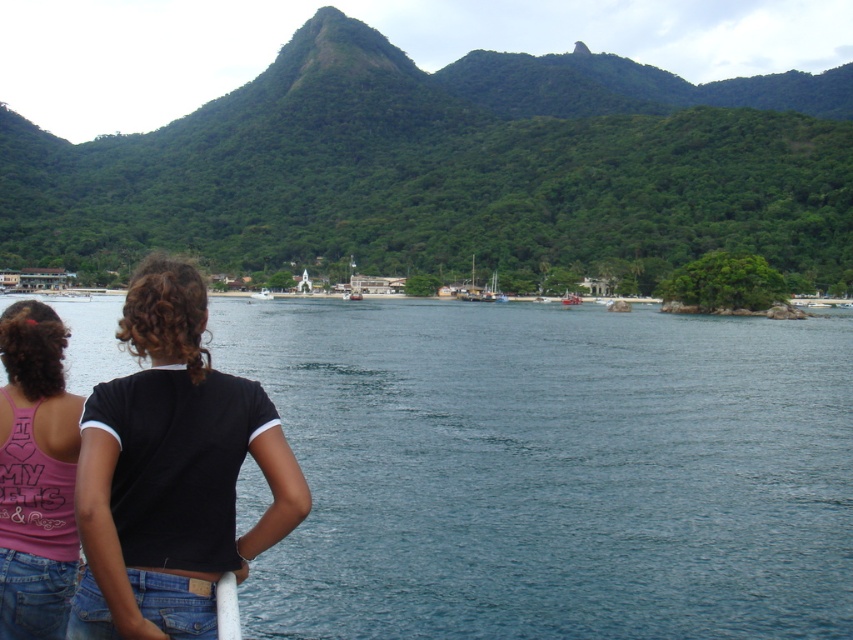
Question: Which object is closer to the camera taking this photo?

Choices:
 (A) white matte boat at center
 (B) blue water at center
 (C) pink fabric tank top at lower left

Answer: (C)

Question: Which of these objects is positioned farthest from the white matte boat at center?

Choices:
 (A) blue water at center
 (B) pink fabric tank top at lower left

Answer: (B)

Question: Which point is closer to the camera?

Choices:
 (A) pink fabric tank top at lower left
 (B) green leafy mountain at upper center

Answer: (A)

Question: Can you confirm if blue water at center is wider than pink fabric tank top at lower left?

Choices:
 (A) yes
 (B) no

Answer: (A)

Question: Does blue water at center appear under black matte shirt at left?

Choices:
 (A) no
 (B) yes

Answer: (A)

Question: Can you confirm if green leafy mountain at upper center is bigger than white matte boat at center?

Choices:
 (A) no
 (B) yes

Answer: (B)